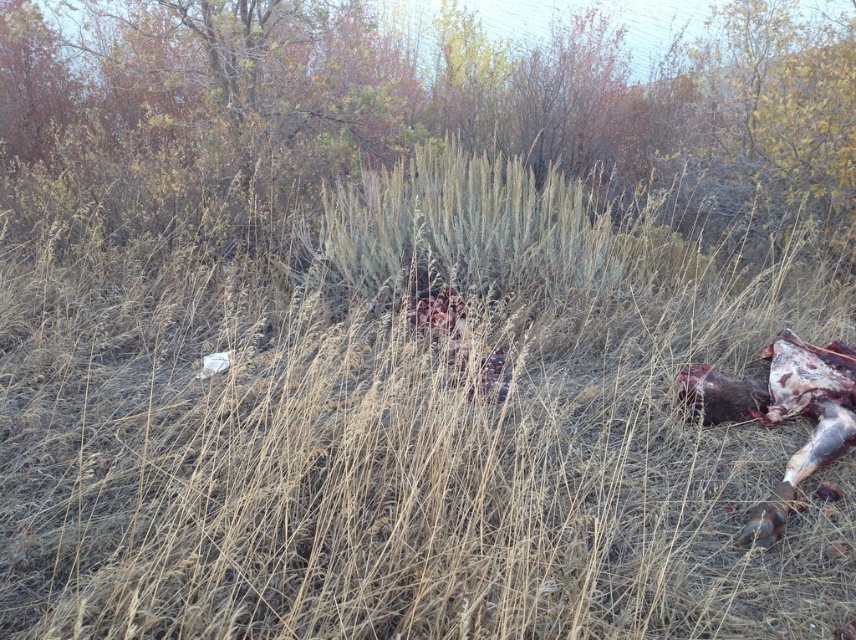
Question: Does green grass at center appear over brown fur animal at lower right?

Choices:
 (A) no
 (B) yes

Answer: (B)

Question: Among these objects, which one is farthest from the camera?

Choices:
 (A) green grass at center
 (B) brown fur animal at lower right

Answer: (A)

Question: Does green grass at center appear on the right side of brown fur animal at lower right?

Choices:
 (A) yes
 (B) no

Answer: (B)

Question: Does green grass at center appear under brown fur animal at lower right?

Choices:
 (A) yes
 (B) no

Answer: (B)